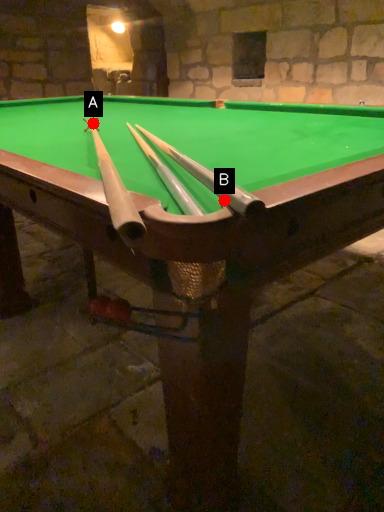
Question: Two points are circled on the image, labeled by A and B beside each circle. Which point is closer to the camera?

Choices:
 (A) A is closer
 (B) B is closer

Answer: (B)